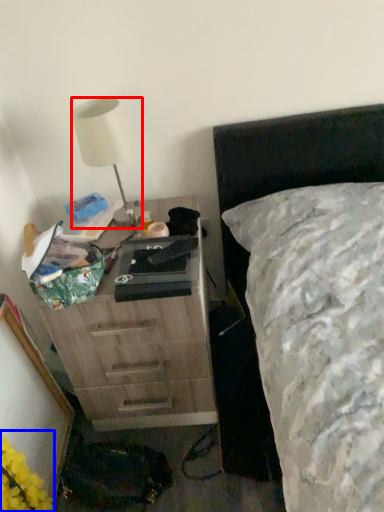
Question: Which point is closer to the camera, lamp (highlighted by a red box) or flower (highlighted by a blue box)?

Choices:
 (A) lamp
 (B) flower

Answer: (B)